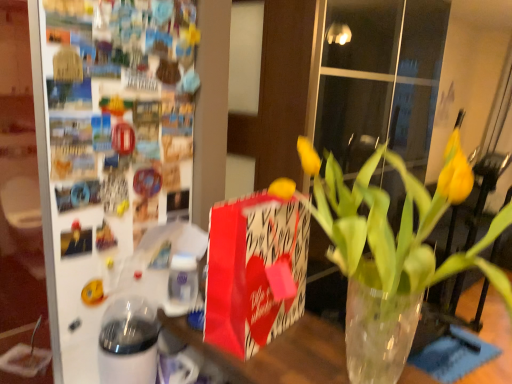
Measure the distance between red paper gift bag at center and camera.

They are 34.35 inches apart.

What do you see at coordinates (254, 271) in the screenshot?
I see `red paper gift bag at center` at bounding box center [254, 271].

The width and height of the screenshot is (512, 384). What do you see at coordinates (128, 342) in the screenshot? I see `white glossy glass jar at lower left` at bounding box center [128, 342].

Identify the location of translucent glass vase at center. (279, 353).

Which is more to the right, red paper gift bag at center or translucent glass vase at center?

red paper gift bag at center is more to the right.

Is red paper gift bag at center aimed at translucent glass vase at center?

No, red paper gift bag at center is not facing towards translucent glass vase at center.

Are yellow matte vase at center and translucent glass vase at center beside each other?

There is a gap between yellow matte vase at center and translucent glass vase at center.

From a real-world perspective, is yellow matte vase at center on top of translucent glass vase at center?

Yes, from a real-world perspective, yellow matte vase at center is on top of translucent glass vase at center.

Is translucent glass vase at center inside yellow matte vase at center?

No.

Can you tell me how much yellow matte vase at center and translucent glass vase at center differ in facing direction?

The angular difference between yellow matte vase at center and translucent glass vase at center is 1.8 degrees.

Is white glossy glass jar at lower left placed right next to translucent glass vase at center?

white glossy glass jar at lower left and translucent glass vase at center are clearly separated.

From the picture: Considering the relative sizes of white glossy glass jar at lower left and translucent glass vase at center in the image provided, is white glossy glass jar at lower left bigger than translucent glass vase at center?

Incorrect, white glossy glass jar at lower left is not larger than translucent glass vase at center.

Considering the relative sizes of white glossy glass jar at lower left and translucent glass vase at center in the image provided, is white glossy glass jar at lower left thinner than translucent glass vase at center?

Indeed, white glossy glass jar at lower left has a lesser width compared to translucent glass vase at center.

Which of these two, red paper gift bag at center or white glossy glass jar at lower left, is smaller?

With smaller size is white glossy glass jar at lower left.

Is red paper gift bag at center surrounding white glossy glass jar at lower left?

Actually, white glossy glass jar at lower left is outside red paper gift bag at center.

In the image, is red paper gift bag at center positioned in front of or behind white glossy glass jar at lower left?

In the image, red paper gift bag at center appears in front of white glossy glass jar at lower left.

Is point (238, 300) farther from camera compared to point (155, 354)?

That is False.

Would you say translucent glass vase at center is a long distance from red paper gift bag at center?

Absolutely, translucent glass vase at center is distant from red paper gift bag at center.

Is translucent glass vase at center to the left or to the right of red paper gift bag at center in the image?

Clearly, translucent glass vase at center is on the left of red paper gift bag at center in the image.

From the image's perspective, who appears lower, translucent glass vase at center or red paper gift bag at center?

translucent glass vase at center is shown below in the image.

Based on the photo, can you confirm if translucent glass vase at center is bigger than red paper gift bag at center?

No, translucent glass vase at center is not bigger than red paper gift bag at center.

Does yellow matte vase at center touch red paper gift bag at center?

No, yellow matte vase at center is not next to red paper gift bag at center.

Does yellow matte vase at center lie in front of red paper gift bag at center?

Yes, it is.

Considering the relative positions of yellow matte vase at center and red paper gift bag at center in the image provided, is yellow matte vase at center to the right of red paper gift bag at center from the viewer's perspective?

Yes.

In terms of width, does yellow matte vase at center look wider or thinner when compared to red paper gift bag at center?

Considering their sizes, yellow matte vase at center looks broader than red paper gift bag at center.

Is yellow matte vase at center positioned before white glossy glass jar at lower left?

Yes, yellow matte vase at center is closer to the camera.

Could white glossy glass jar at lower left be considered to be inside yellow matte vase at center?

No, white glossy glass jar at lower left is not a part of yellow matte vase at center.

Which of these two, yellow matte vase at center or white glossy glass jar at lower left, is wider?

Wider between the two is yellow matte vase at center.

From a real-world perspective, which is physically below, yellow matte vase at center or white glossy glass jar at lower left?

white glossy glass jar at lower left is physically lower.

Image resolution: width=512 pixels, height=384 pixels. Find the location of `table that is under the red paper gift bag at center (from a real-world perspective)`. table that is under the red paper gift bag at center (from a real-world perspective) is located at coordinates (279, 353).

Find the location of a particular element. The height and width of the screenshot is (384, 512). table located behind the yellow matte vase at center is located at coordinates (279, 353).

Considering their positions, is translucent glass vase at center positioned closer to white glossy glass jar at lower left than yellow matte vase at center?

yellow matte vase at center lies closer to white glossy glass jar at lower left than the other object.

When comparing their distances from yellow matte vase at center, does translucent glass vase at center or white glossy glass jar at lower left seem further?

The object further to yellow matte vase at center is translucent glass vase at center.

When comparing their distances from translucent glass vase at center, does white glossy glass jar at lower left or red paper gift bag at center seem further?

white glossy glass jar at lower left is positioned further to the anchor translucent glass vase at center.

When comparing their distances from white glossy glass jar at lower left, does red paper gift bag at center or yellow matte vase at center seem closer?

red paper gift bag at center is closer to white glossy glass jar at lower left.

Based on their spatial positions, is red paper gift bag at center or white glossy glass jar at lower left closer to translucent glass vase at center?

Based on the image, red paper gift bag at center appears to be nearer to translucent glass vase at center.

From the image, which object appears to be nearer to translucent glass vase at center, yellow matte vase at center or white glossy glass jar at lower left?

Among the two, yellow matte vase at center is located nearer to translucent glass vase at center.

Based on the photo, when comparing their distances from translucent glass vase at center, does red paper gift bag at center or yellow matte vase at center seem further?

The object further to translucent glass vase at center is red paper gift bag at center.

Estimate the real-world distances between objects in this image. Which object is further from red paper gift bag at center, yellow matte vase at center or translucent glass vase at center?

→ The object further to red paper gift bag at center is translucent glass vase at center.

Locate an element on the screen. gift bag between white glossy glass jar at lower left and yellow matte vase at center is located at coordinates (254, 271).

Locate an element on the screen. table located between white glossy glass jar at lower left and yellow matte vase at center in the left-right direction is located at coordinates (279, 353).

Locate an element on the screen. table between yellow matte vase at center and red paper gift bag at center in the front-back direction is located at coordinates (279, 353).

The image size is (512, 384). What are the coordinates of `table situated between white glossy glass jar at lower left and red paper gift bag at center from left to right` in the screenshot? It's located at (279, 353).